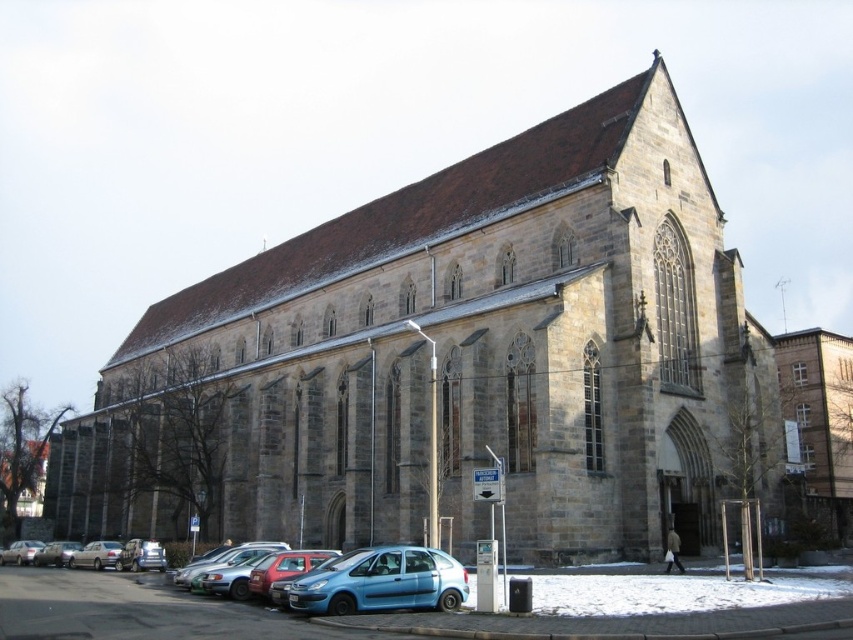
You are a delivery person trying to park your truck between the silver metallic sedan at lower left and the matte silver car at lower left. The truck requires a minimum of 1.8 meters of space. Can you fit your truck between them based on their sizes?

The silver metallic sedan at lower left is shorter than the matte silver car at lower left, but without specific measurements of the space between them, it is impossible to determine if the truck can fit. The description only provides information about their relative sizes, not the distance between the vehicles.

You are a pedestrian standing on the sidewalk in front of the historic stone building. You see a blue metallic hatchback at lower center and a silver metallic sedan at lower left. Which vehicle is closer to you?

The blue metallic hatchback at lower center is closer to you because it is positioned in front of the silver metallic sedan at lower left.

You are a pedestrian standing at the entrance of the historic stone building. You want to cross the street to reach a coffee shop across the road. The blue metallic hatchback at lower center and the silver metallic car at lower left are parked on the same side of the street as you. Which car is closer to the curb?

The silver metallic car at lower left is closer to the curb because the blue metallic hatchback at lower center is located above it, meaning it is parked behind the silver metallic car at lower left.